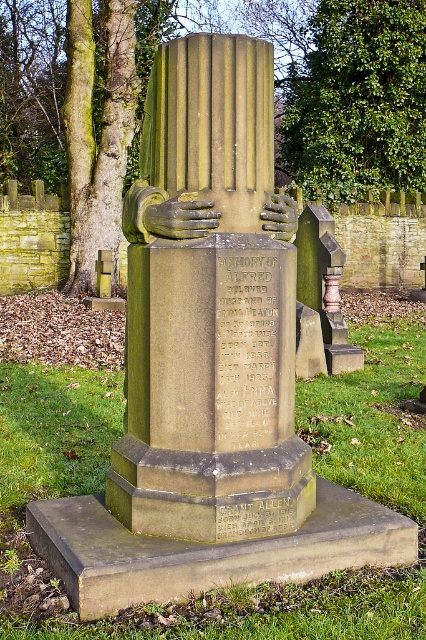
Question: Is green polished stone column at center further to the viewer compared to green leafy tree at upper center?

Choices:
 (A) yes
 (B) no

Answer: (B)

Question: Is green polished stone column at center positioned at the back of green leafy tree at upper center?

Choices:
 (A) no
 (B) yes

Answer: (A)

Question: From the image, what is the correct spatial relationship of green polished stone column at center in relation to green leafy tree at upper center?

Choices:
 (A) left
 (B) right

Answer: (A)

Question: Which point is farther to the camera?

Choices:
 (A) green leafy tree at upper center
 (B) green polished stone column at center

Answer: (A)

Question: Which point is farther to the camera?

Choices:
 (A) (339, 42)
 (B) (224, 156)

Answer: (A)